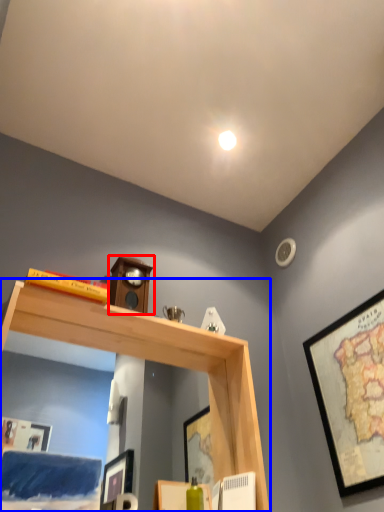
Question: Which object is further to the camera taking this photo, clock (highlighted by a red box) or shelf (highlighted by a blue box)?

Choices:
 (A) clock
 (B) shelf

Answer: (A)